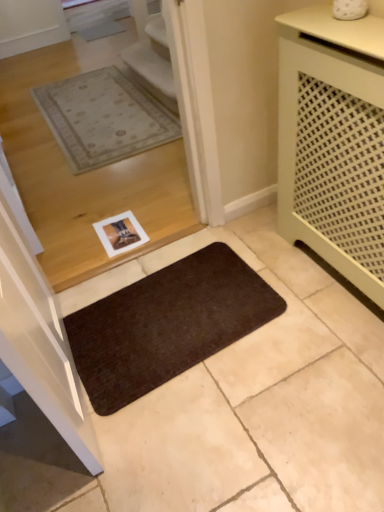
The image size is (384, 512). Identify the location of vacant space situated above brown matte mat at lower center (from a real-world perspective). (163, 309).